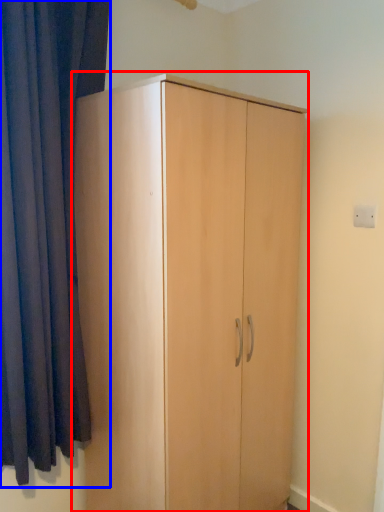
Question: Which object appears farthest to the camera in this image, cupboard (highlighted by a red box) or curtain (highlighted by a blue box)?

Choices:
 (A) cupboard
 (B) curtain

Answer: (A)